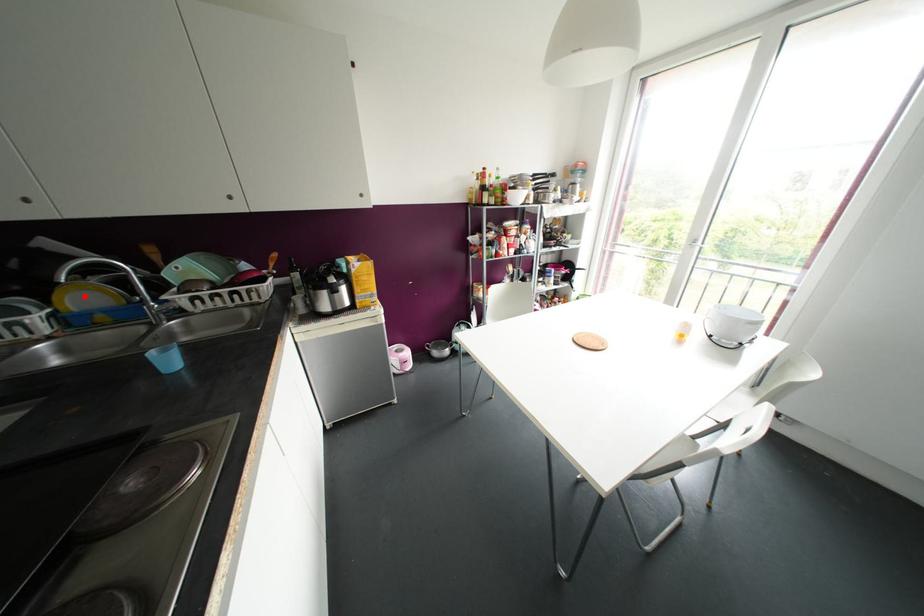
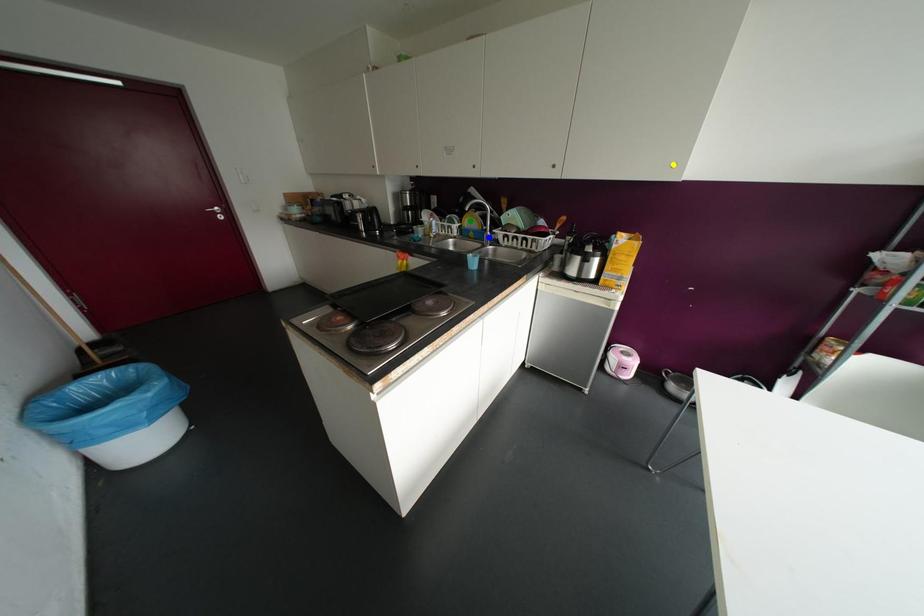
Question: I am providing you with two images of the same scene from different viewpoints. A red point is marked on the first image. You are given multiple points on the second image. Which point in image 2 is actually the same real-world point as the red point in image 1?

Choices:
 (A) green point
 (B) blue point
 (C) yellow point

Answer: (A)